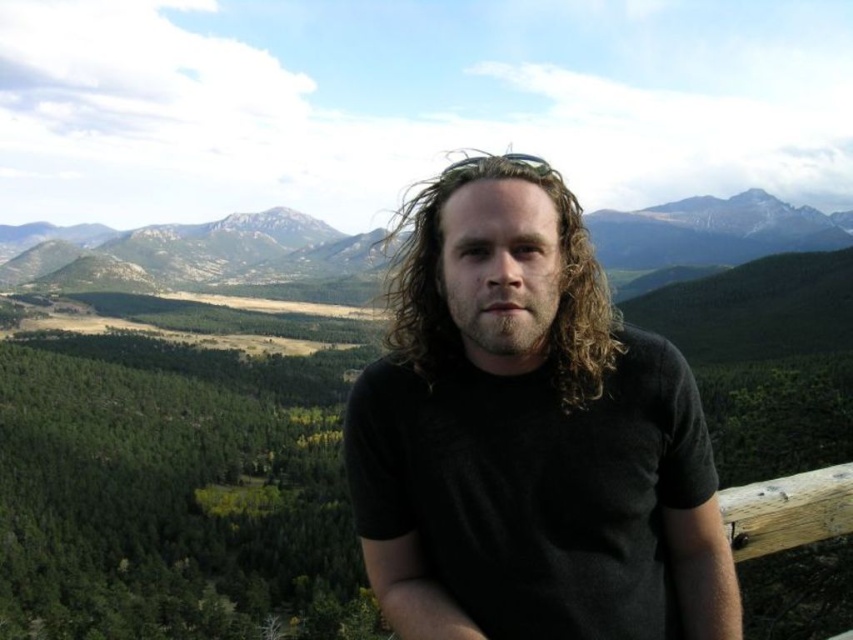
Does green forested mountains at upper center have a smaller size compared to black matte shirt at center?

Actually, green forested mountains at upper center might be larger than black matte shirt at center.

Is green forested mountains at upper center to the left of black matte shirt at center from the viewer's perspective?

Correct, you'll find green forested mountains at upper center to the left of black matte shirt at center.

Identify the location of green forested mountains at upper center. The image size is (853, 640). (175, 483).

Between green forested mountains at upper center and curly blonde hair at center, which one is positioned lower?

green forested mountains at upper center is lower down.

What do you see at coordinates (175, 483) in the screenshot?
I see `green forested mountains at upper center` at bounding box center [175, 483].

Locate an element on the screen. The image size is (853, 640). green forested mountains at upper center is located at coordinates (175, 483).

Can you confirm if black matte shirt at center is positioned to the right of curly blonde hair at center?

Indeed, black matte shirt at center is positioned on the right side of curly blonde hair at center.

Between black matte shirt at center and curly blonde hair at center, which one has less height?

→ curly blonde hair at center is shorter.

The width and height of the screenshot is (853, 640). Describe the element at coordinates (531, 449) in the screenshot. I see `black matte shirt at center` at that location.

In order to click on black matte shirt at center in this screenshot , I will do `click(531, 449)`.